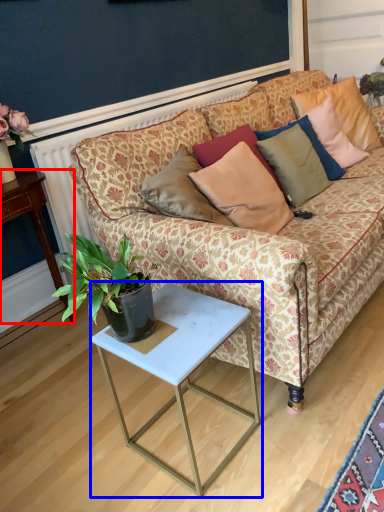
Question: Which object is further to the camera taking this photo, desk (highlighted by a red box) or table (highlighted by a blue box)?

Choices:
 (A) desk
 (B) table

Answer: (A)